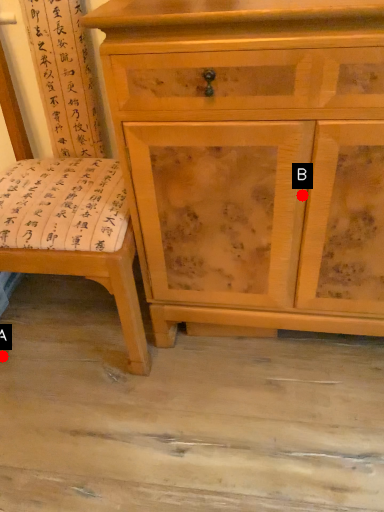
Question: Two points are circled on the image, labeled by A and B beside each circle. Which point is closer to the camera?

Choices:
 (A) A is closer
 (B) B is closer

Answer: (B)